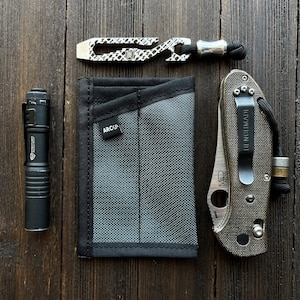
At what (x,y) coordinates should I click in order to perform the action: click on hook to hang tool. Please return your answer as a coordinate pair (x, y). The width and height of the screenshot is (300, 300). Looking at the image, I should click on (242, 126), (24, 136).